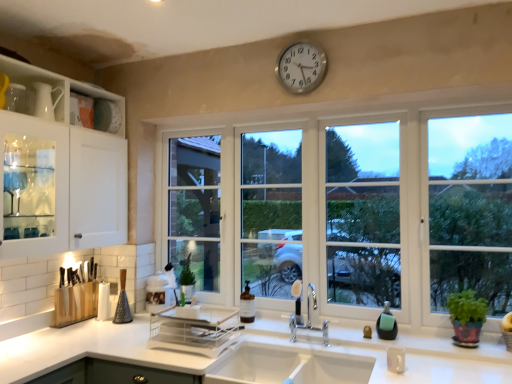
Question: Is green leafy plant in pot at right aimed at white glossy countertop at lower center?

Choices:
 (A) yes
 (B) no

Answer: (B)

Question: Is green leafy plant in pot at right positioned in front of white glossy countertop at lower center?

Choices:
 (A) no
 (B) yes

Answer: (A)

Question: Is green leafy plant in pot at right in contact with white glossy countertop at lower center?

Choices:
 (A) no
 (B) yes

Answer: (A)

Question: From a real-world perspective, is green leafy plant in pot at right located beneath white glossy countertop at lower center?

Choices:
 (A) no
 (B) yes

Answer: (A)

Question: Considering the relative positions of green leafy plant in pot at right and white glossy countertop at lower center in the image provided, is green leafy plant in pot at right to the right of white glossy countertop at lower center from the viewer's perspective?

Choices:
 (A) yes
 (B) no

Answer: (A)

Question: Are green leafy plant in pot at right and white glossy countertop at lower center located far from each other?

Choices:
 (A) yes
 (B) no

Answer: (B)

Question: Does silver metallic clock at upper center have a greater height compared to translucent glass soap dispenser at sink?

Choices:
 (A) no
 (B) yes

Answer: (B)

Question: Is silver metallic clock at upper center smaller than translucent glass soap dispenser at sink?

Choices:
 (A) yes
 (B) no

Answer: (B)

Question: Does silver metallic clock at upper center have a larger size compared to translucent glass soap dispenser at sink?

Choices:
 (A) yes
 (B) no

Answer: (A)

Question: Is silver metallic clock at upper center next to translucent glass soap dispenser at sink?

Choices:
 (A) no
 (B) yes

Answer: (A)

Question: Is silver metallic clock at upper center closer to the viewer compared to translucent glass soap dispenser at sink?

Choices:
 (A) yes
 (B) no

Answer: (A)

Question: From a real-world perspective, is silver metallic clock at upper center on top of translucent glass soap dispenser at sink?

Choices:
 (A) no
 (B) yes

Answer: (B)

Question: From a real-world perspective, is clear plastic tray at center located higher than white ceramic sink at center?

Choices:
 (A) no
 (B) yes

Answer: (B)